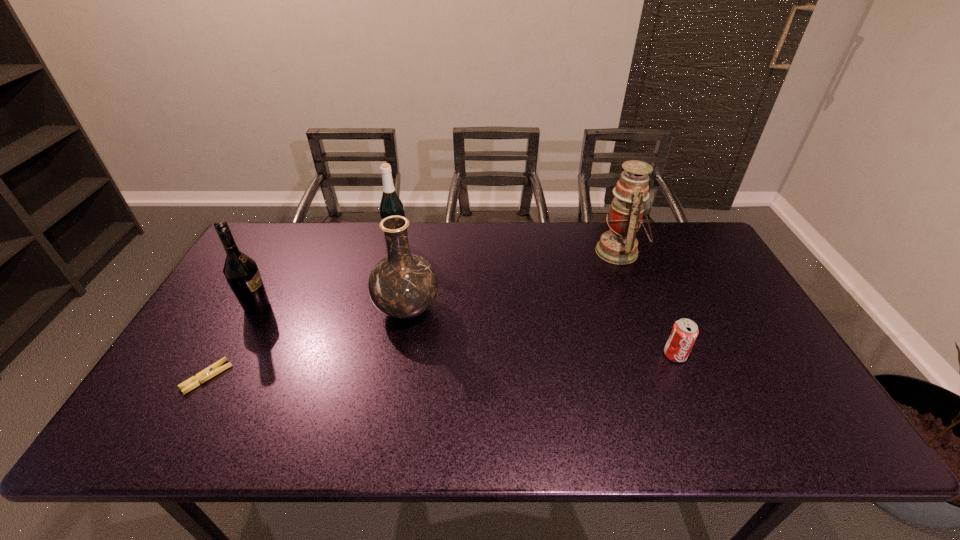
At what (x,y) coordinates should I click in order to perform the action: click on empty space between the fifth tallest object and the left wine bottle. Please return your answer as a coordinate pair (x, y). Looking at the image, I should click on (467, 331).

Image resolution: width=960 pixels, height=540 pixels. In order to click on empty location between the vase and the soda can in this screenshot , I will do `click(540, 332)`.

Identify which object is the fourth nearest to the shortest object. Please provide its 2D coordinates. Your answer should be formatted as a tuple, i.e. [(x, y)], where the tuple contains the x and y coordinates of a point satisfying the conditions above.

[(619, 245)]

Identify which object is located as the fourth nearest to the clothespin. Please provide its 2D coordinates. Your answer should be formatted as a tuple, i.e. [(x, y)], where the tuple contains the x and y coordinates of a point satisfying the conditions above.

[(619, 245)]

Locate an element on the screen. The height and width of the screenshot is (540, 960). free region that satisfies the following two spatial constraints: 1. on the label of the farther wine bottle; 2. on the left side of the soda can is located at coordinates (372, 355).

Identify the location of vacant region that satisfies the following two spatial constraints: 1. on the label of the fifth tallest object; 2. on the right side of the right wine bottle. The width and height of the screenshot is (960, 540). (372, 355).

The height and width of the screenshot is (540, 960). What are the coordinates of `free region that satisfies the following two spatial constraints: 1. on the label of the nearer wine bottle; 2. on the back side of the soda can` in the screenshot? It's located at (231, 355).

Locate an element on the screen. The height and width of the screenshot is (540, 960). free space that satisfies the following two spatial constraints: 1. on the label of the second shortest object; 2. on the left side of the right wine bottle is located at coordinates (372, 355).

You are a GUI agent. You are given a task and a screenshot of the screen. Output one action in this format:
    pyautogui.click(x=<x>, y=<y>)
    Task: Click on the vacant area in the image that satisfies the following two spatial constraints: 1. on the label of the right wine bottle; 2. on the label of the left wine bottle
    
    Given the screenshot: What is the action you would take?
    pyautogui.click(x=383, y=307)

This screenshot has height=540, width=960. I want to click on free space that satisfies the following two spatial constraints: 1. on the back side of the oil lamp; 2. on the left side of the vase, so click(417, 252).